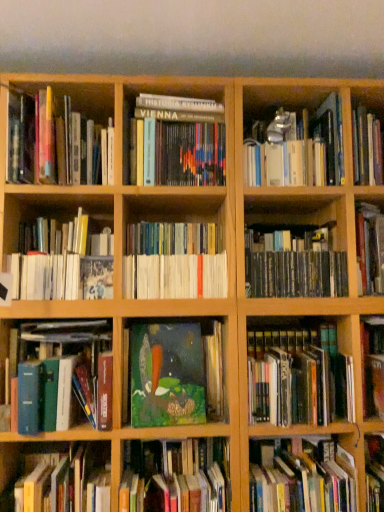
Locate an element on the screen. The image size is (384, 512). hardcover book at center right, the ninth book in the top-to-bottom sequence is located at coordinates (298, 378).

Where is `hardcover book at upper left, the 11th book from the bottom`? hardcover book at upper left, the 11th book from the bottom is located at coordinates (57, 141).

The image size is (384, 512). In order to click on hardcover book at left, the 6th book in the bottom-to-top sequence in this screenshot , I will do `click(56, 370)`.

This screenshot has width=384, height=512. Describe the element at coordinates (177, 142) in the screenshot. I see `hardcover book at center, which ranks as the 3th book in top-to-bottom order` at that location.

What do you see at coordinates (294, 272) in the screenshot?
I see `black matte cd case at center right, the 6th book positioned from the top` at bounding box center [294, 272].

What are the coordinates of `hardcover book at center right, the ninth book in the top-to-bottom sequence` in the screenshot? It's located at (298, 378).

Considering the sizes of objects hardcover book at left, the 6th book in the bottom-to-top sequence, and black matte cd case at center right, which appears as the seventh book when ordered from the bottom, in the image provided, who is thinner, hardcover book at left, the 6th book in the bottom-to-top sequence, or black matte cd case at center right, which appears as the seventh book when ordered from the bottom,?

hardcover book at left, the 6th book in the bottom-to-top sequence.

Considering their positions, is hardcover book at left, which is the seventh book in top-to-bottom order, located in front of or behind black matte cd case at center right, which appears as the seventh book when ordered from the bottom?

Clearly, hardcover book at left, which is the seventh book in top-to-bottom order, is in front of black matte cd case at center right, which appears as the seventh book when ordered from the bottom.

Is hardcover book at left, which is the seventh book in top-to-bottom order, oriented away from black matte cd case at center right, the 6th book positioned from the top?

That's not correct — hardcover book at left, which is the seventh book in top-to-bottom order, is not looking away from black matte cd case at center right, the 6th book positioned from the top.

Between hardcover book at left, which is the seventh book in top-to-bottom order, and black matte cd case at center right, the 6th book positioned from the top, which one has less height?

Standing shorter between the two is hardcover book at left, which is the seventh book in top-to-bottom order.

Is the position of black matte cd case at center right, which appears as the seventh book when ordered from the bottom, more distant than that of green matte book at center, the tenth book viewed from the top?

Yes, black matte cd case at center right, which appears as the seventh book when ordered from the bottom, is further from the viewer.

Does black matte cd case at center right, the 6th book positioned from the top, appear on the left side of green matte book at center, the tenth book viewed from the top?

In fact, black matte cd case at center right, the 6th book positioned from the top, is to the right of green matte book at center, the tenth book viewed from the top.

Considering the sizes of objects black matte cd case at center right, which appears as the seventh book when ordered from the bottom, and green matte book at center, the tenth book viewed from the top, in the image provided, who is thinner, black matte cd case at center right, which appears as the seventh book when ordered from the bottom, or green matte book at center, the tenth book viewed from the top,?

With smaller width is green matte book at center, the tenth book viewed from the top.

Is point (198, 108) farther from viewer compared to point (92, 176)?

Yes, it is behind point (92, 176).

Considering the relative positions of hardcover book at center, which ranks as the 3th book in top-to-bottom order, and hardcover book at upper left, acting as the second book starting from the top, in the image provided, is hardcover book at center, which ranks as the 3th book in top-to-bottom order, to the left of hardcover book at upper left, acting as the second book starting from the top, from the viewer's perspective?

No.

Considering the sizes of objects hardcover book at center, the tenth book from the bottom, and hardcover book at upper left, acting as the second book starting from the top, in the image provided, who is shorter, hardcover book at center, the tenth book from the bottom, or hardcover book at upper left, acting as the second book starting from the top,?

Standing shorter between the two is hardcover book at center, the tenth book from the bottom.

Considering the sizes of objects hardcover book at lower right, arranged as the 1th book when ordered from the bottom, and green matte book at center, the tenth book viewed from the top, in the image provided, who is wider, hardcover book at lower right, arranged as the 1th book when ordered from the bottom, or green matte book at center, the tenth book viewed from the top,?

green matte book at center, the tenth book viewed from the top.

Considering the positions of objects hardcover book at lower right, arranged as the 1th book when ordered from the bottom, and green matte book at center, the tenth book viewed from the top, in the image provided, who is in front, hardcover book at lower right, arranged as the 1th book when ordered from the bottom, or green matte book at center, the tenth book viewed from the top,?

green matte book at center, the tenth book viewed from the top, is more forward.

Could you tell me if hardcover book at lower right, arranged as the twelfth book when viewed from the top, is turned towards green matte book at center, the tenth book viewed from the top?

No, hardcover book at lower right, arranged as the twelfth book when viewed from the top, is not oriented towards green matte book at center, the tenth book viewed from the top.

From the image's perspective, who appears lower, hardcover book at left, the 6th book in the bottom-to-top sequence, or hardcover book at lower right, arranged as the 1th book when ordered from the bottom?

hardcover book at lower right, arranged as the 1th book when ordered from the bottom, from the image's perspective.

Can you confirm if hardcover book at left, which is the seventh book in top-to-bottom order, is shorter than hardcover book at lower right, arranged as the twelfth book when viewed from the top?

In fact, hardcover book at left, which is the seventh book in top-to-bottom order, may be taller than hardcover book at lower right, arranged as the twelfth book when viewed from the top.

Which of these two, hardcover book at left, which is the seventh book in top-to-bottom order, or hardcover book at lower right, arranged as the 1th book when ordered from the bottom, is bigger?

hardcover book at left, which is the seventh book in top-to-bottom order.

Is hardcover book at left, which is the seventh book in top-to-bottom order, spatially inside hardcover book at lower right, arranged as the twelfth book when viewed from the top, or outside of it?

hardcover book at left, which is the seventh book in top-to-bottom order, exists outside the volume of hardcover book at lower right, arranged as the twelfth book when viewed from the top.

Starting from the white paperbacks at center, arranged as the 5th book when viewed from the top, which book is the 4th one to the right? Please provide its 2D coordinates.

[(294, 272)]

How far apart are white paperbacks at center, placed as the 8th book when sorted from bottom to top, and black matte cd case at center right, which appears as the seventh book when ordered from the bottom?

white paperbacks at center, placed as the 8th book when sorted from bottom to top, and black matte cd case at center right, which appears as the seventh book when ordered from the bottom, are 9.73 inches apart from each other.

Is white paperbacks at center, arranged as the 5th book when viewed from the top, bigger than black matte cd case at center right, which appears as the seventh book when ordered from the bottom?

Actually, white paperbacks at center, arranged as the 5th book when viewed from the top, might be smaller than black matte cd case at center right, which appears as the seventh book when ordered from the bottom.

Which object is more forward, hardcover book at center right, the ninth book in the top-to-bottom sequence, or hardcover book at upper right, which is the twelfth book in bottom-to-top order?

hardcover book at center right, the ninth book in the top-to-bottom sequence, is more forward.

Is hardcover book at center right, the ninth book in the top-to-bottom sequence, next to hardcover book at upper right, the first book from the top, and touching it?

No, hardcover book at center right, the ninth book in the top-to-bottom sequence, is not next to hardcover book at upper right, the first book from the top.

What's the angular difference between hardcover book at center right, marked as the fourth book in a bottom-to-top arrangement, and hardcover book at upper right, the first book from the top,'s facing directions?

The facing directions of hardcover book at center right, marked as the fourth book in a bottom-to-top arrangement, and hardcover book at upper right, the first book from the top, are 0.222 degrees apart.

Does hardcover book at center right, the ninth book in the top-to-bottom sequence, have a lesser height compared to hardcover book at upper right, the first book from the top?

Yes.

This screenshot has height=512, width=384. I want to click on the 2nd book located above the hardcover book at left, the 6th book in the bottom-to-top sequence (from a real-world perspective), so click(294, 272).

This screenshot has height=512, width=384. I want to click on the 4th book above when counting from the green matte book at center, the tenth book viewed from the top (from the image's perspective), so click(x=294, y=272).

Based on their spatial positions, is white paperbacks at left, which is the 4th book in top-to-bottom order, or green matte book at center, the tenth book viewed from the top, closer to green matte painting at center, the fifth book in the bottom-to-top sequence?

Based on the image, green matte book at center, the tenth book viewed from the top, appears to be nearer to green matte painting at center, the fifth book in the bottom-to-top sequence.

Estimate the real-world distances between objects in this image. Which object is further from black matte cd case at center right, the 6th book positioned from the top, hardcover book at left, the 6th book in the bottom-to-top sequence, or hardcover book at lower left, the second book ordered from the bottom?

hardcover book at lower left, the second book ordered from the bottom.

Based on their spatial positions, is black matte cd case at center right, the 6th book positioned from the top, or hardcover book at lower right, arranged as the twelfth book when viewed from the top, further from hardcover book at lower left, positioned as the eleventh book in top-to-bottom order?

The object further to hardcover book at lower left, positioned as the eleventh book in top-to-bottom order, is black matte cd case at center right, the 6th book positioned from the top.

Based on their spatial positions, is black matte cd case at center right, the 6th book positioned from the top, or green matte painting at center, the fifth book in the bottom-to-top sequence, closer to hardcover book at upper right, the first book from the top?

black matte cd case at center right, the 6th book positioned from the top, lies closer to hardcover book at upper right, the first book from the top, than the other object.

Estimate the real-world distances between objects in this image. Which object is closer to green matte painting at center, the 8th book from the top, white paperbacks at left, acting as the 9th book starting from the bottom, or hardcover book at center right, marked as the fourth book in a bottom-to-top arrangement?

Based on the image, hardcover book at center right, marked as the fourth book in a bottom-to-top arrangement, appears to be nearer to green matte painting at center, the 8th book from the top.

From the image, which object appears to be nearer to white paperbacks at left, which is the 4th book in top-to-bottom order, hardcover book at lower left, the second book ordered from the bottom, or hardcover book at upper left, the 11th book from the bottom?

hardcover book at upper left, the 11th book from the bottom, lies closer to white paperbacks at left, which is the 4th book in top-to-bottom order, than the other object.

From the picture: Estimate the real-world distances between objects in this image. Which object is further from hardcover book at lower left, the second book ordered from the bottom, hardcover book at upper left, the 11th book from the bottom, or hardcover book at lower right, arranged as the 1th book when ordered from the bottom?

hardcover book at upper left, the 11th book from the bottom.

Looking at the image, which one is located closer to green matte book at center, the 3th book when ordered from bottom to top, green matte painting at center, the fifth book in the bottom-to-top sequence, or hardcover book at lower left, the second book ordered from the bottom?

Among the two, hardcover book at lower left, the second book ordered from the bottom, is located nearer to green matte book at center, the 3th book when ordered from bottom to top.